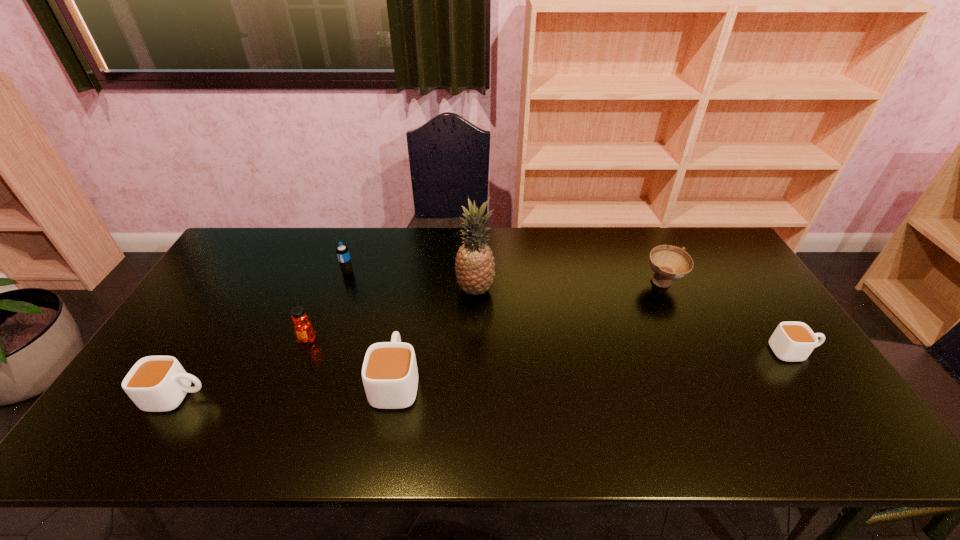
You are a GUI agent. You are given a task and a screenshot of the screen. Output one action in this format:
    pyautogui.click(x=<x>, y=<y>)
    Task: Click on the leftmost cup
    This screenshot has height=540, width=960.
    Given the screenshot: What is the action you would take?
    155,383

Where is `the leftmost object`? The image size is (960, 540). the leftmost object is located at coordinates (155, 383).

What are the coordinates of `the fourth object from left to right` in the screenshot? It's located at (389, 372).

The height and width of the screenshot is (540, 960). In order to click on the second cup from left to right in this screenshot , I will do `click(389, 372)`.

You are a GUI agent. You are given a task and a screenshot of the screen. Output one action in this format:
    pyautogui.click(x=<x>, y=<y>)
    Task: Click on the rightmost object
    The width and height of the screenshot is (960, 540).
    Given the screenshot: What is the action you would take?
    pyautogui.click(x=791, y=341)

The width and height of the screenshot is (960, 540). What are the coordinates of `the rightmost cup` in the screenshot? It's located at (791, 341).

You are a GUI agent. You are given a task and a screenshot of the screen. Output one action in this format:
    pyautogui.click(x=<x>, y=<y>)
    Task: Click on the third object from left to right
    
    Given the screenshot: What is the action you would take?
    pyautogui.click(x=342, y=251)

I want to click on the tallest object, so click(x=475, y=269).

This screenshot has height=540, width=960. What are the coordinates of `pineapple` in the screenshot? It's located at (475, 269).

Identify the location of soup bowl. The image size is (960, 540). (669, 262).